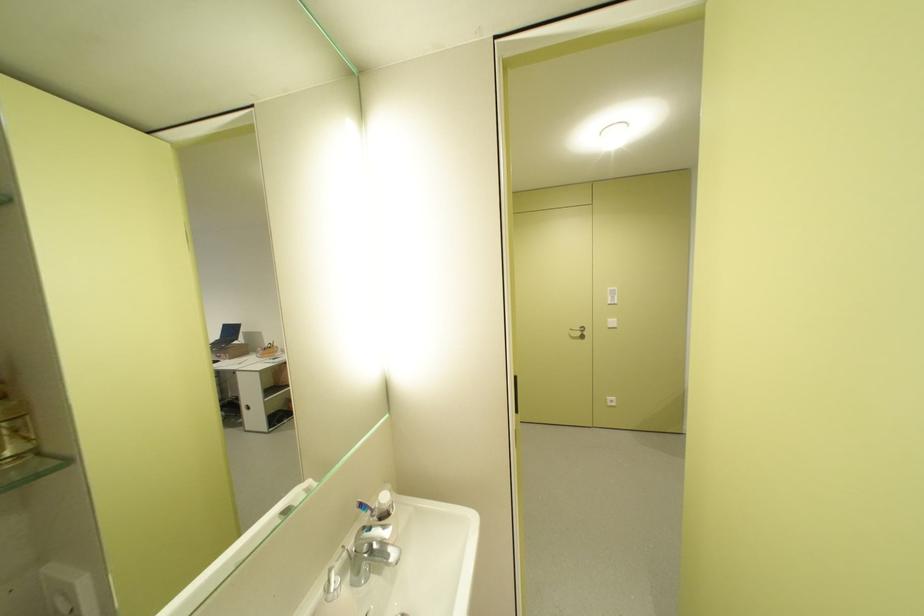
This screenshot has height=616, width=924. What do you see at coordinates (332, 585) in the screenshot? I see `the dispenser pump head` at bounding box center [332, 585].